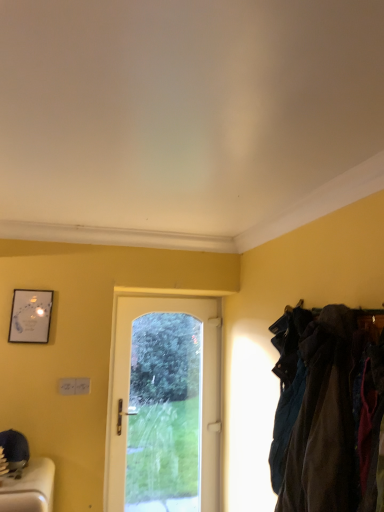
Question: Considering the relative sizes of white glass door at center and matte silver picture frame at upper left in the image provided, is white glass door at center shorter than matte silver picture frame at upper left?

Choices:
 (A) yes
 (B) no

Answer: (B)

Question: Is white glass door at center outside of matte silver picture frame at upper left?

Choices:
 (A) yes
 (B) no

Answer: (A)

Question: From the image's perspective, is white glass door at center on matte silver picture frame at upper left?

Choices:
 (A) no
 (B) yes

Answer: (A)

Question: From a real-world perspective, is white glass door at center located higher than matte silver picture frame at upper left?

Choices:
 (A) yes
 (B) no

Answer: (B)

Question: Does white glass door at center appear on the left side of matte silver picture frame at upper left?

Choices:
 (A) yes
 (B) no

Answer: (B)

Question: Relative to white glass door at center, is dark blue fabric at right in front or behind?

Choices:
 (A) behind
 (B) front

Answer: (B)

Question: From the image's perspective, relative to white glass door at center, is dark blue fabric at right above or below?

Choices:
 (A) below
 (B) above

Answer: (B)

Question: Looking at their shapes, would you say dark blue fabric at right is wider or thinner than white glass door at center?

Choices:
 (A) thin
 (B) wide

Answer: (B)

Question: From their relative heights in the image, would you say dark blue fabric at right is taller or shorter than white glass door at center?

Choices:
 (A) short
 (B) tall

Answer: (A)

Question: Is dark blue fabric at right taller or shorter than matte silver picture frame at upper left?

Choices:
 (A) short
 (B) tall

Answer: (B)

Question: Considering the positions of point (281, 379) and point (39, 317), is point (281, 379) closer or farther from the camera than point (39, 317)?

Choices:
 (A) closer
 (B) farther

Answer: (A)

Question: Relative to matte silver picture frame at upper left, is dark blue fabric at right in front or behind?

Choices:
 (A) behind
 (B) front

Answer: (B)

Question: Considering the positions of dark blue fabric at right and matte silver picture frame at upper left in the image, is dark blue fabric at right bigger or smaller than matte silver picture frame at upper left?

Choices:
 (A) small
 (B) big

Answer: (B)

Question: Looking at the image, does white glass door at center seem bigger or smaller compared to matte silver picture frame at upper left?

Choices:
 (A) big
 (B) small

Answer: (A)

Question: From the image's perspective, relative to matte silver picture frame at upper left, is white glass door at center above or below?

Choices:
 (A) above
 (B) below

Answer: (B)